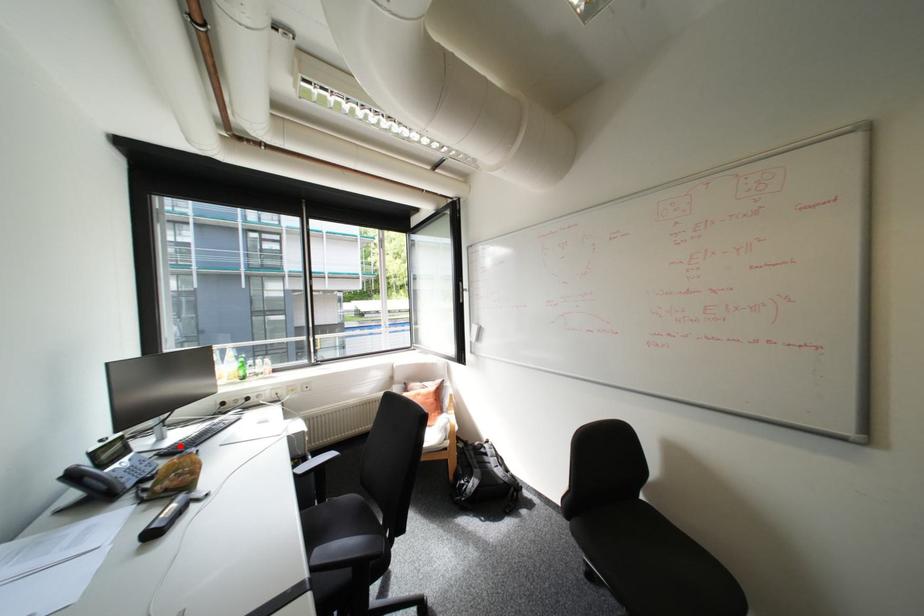
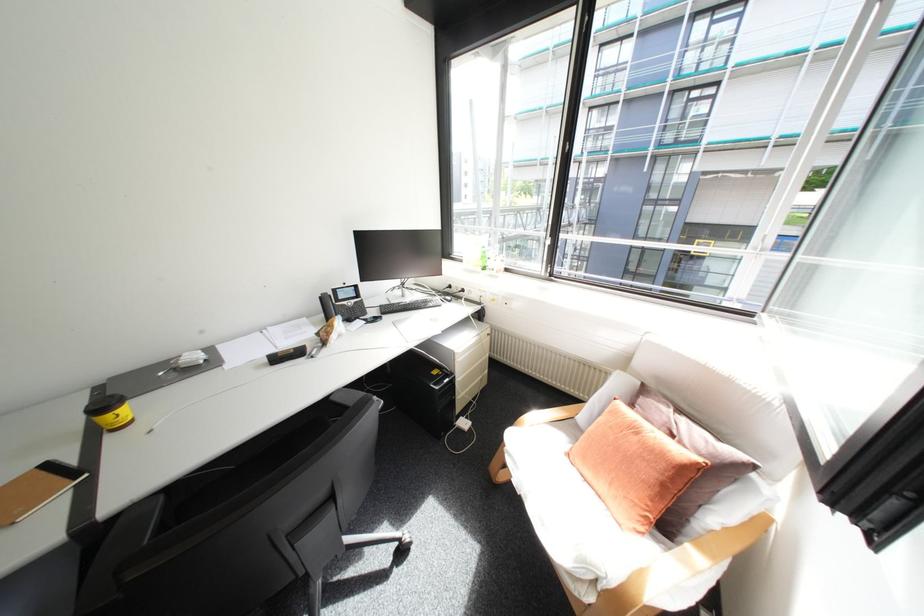
Find the pixel in the second image that matches the highlighted location in the first image.

(403, 304)